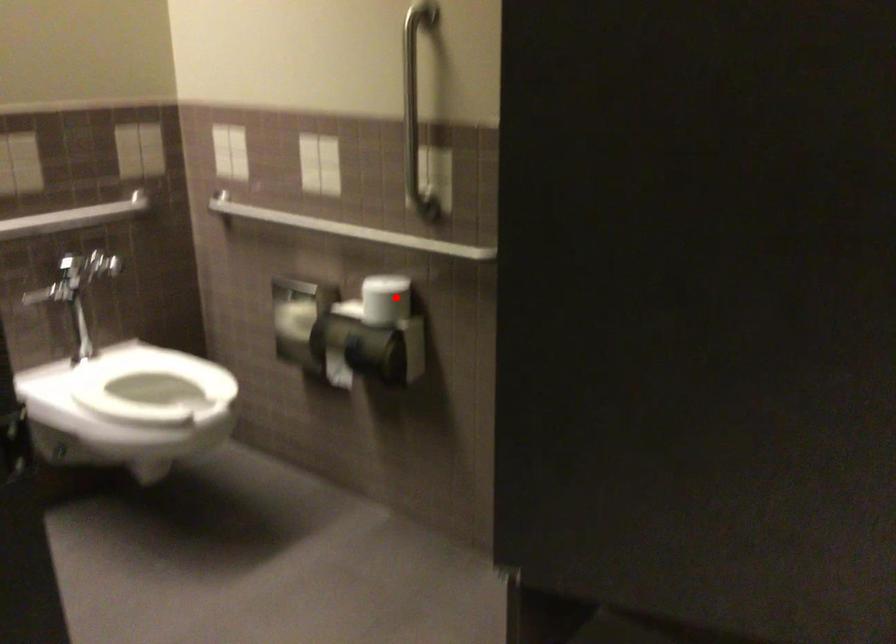
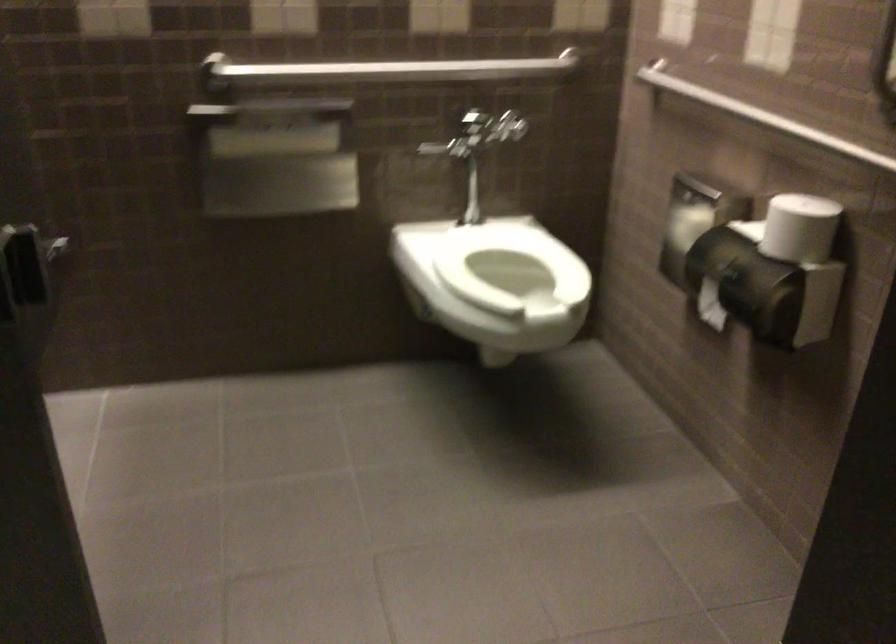
Question: A red point is marked in image1. In image2, is the corresponding 3D point closer to the camera or farther? Reply with the corresponding letter.

Choices:
 (A) The corresponding 3D point is closer.
 (B) The corresponding 3D point is farther.

Answer: (A)